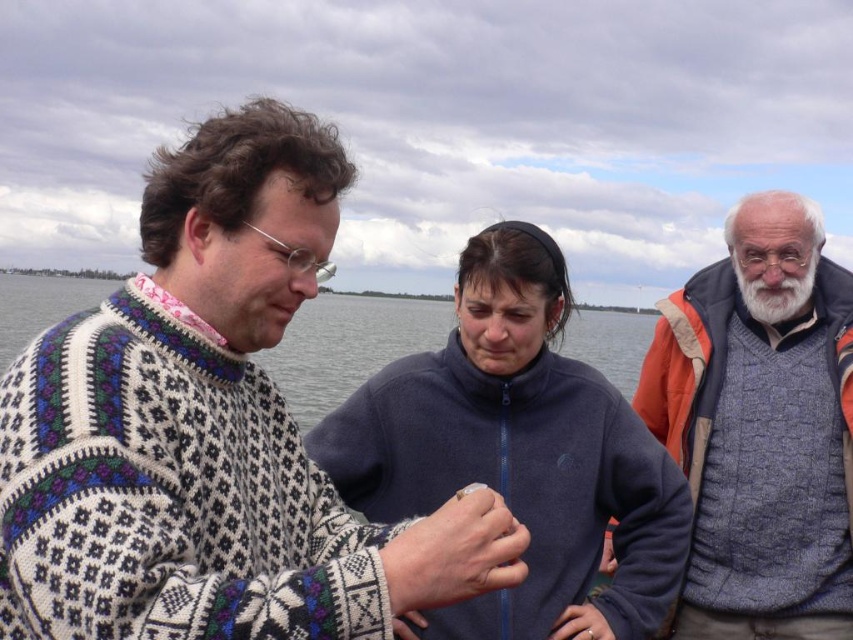
Question: Is dark blue fleece at center smaller than gray wool sweater at right?

Choices:
 (A) yes
 (B) no

Answer: (A)

Question: Estimate the real-world distances between objects in this image. Which object is closer to the gray wool sweater at right?

Choices:
 (A) dark blue fleece at center
 (B) knitted sweater at center
 (C) white fluffy beard at upper right

Answer: (C)

Question: Which object is positioned farthest from the knitted sweater at center?

Choices:
 (A) dark blue fleece at center
 (B) white fluffy beard at upper right

Answer: (B)

Question: Can you confirm if knitted sweater at center is positioned below dark blue fleece at center?

Choices:
 (A) no
 (B) yes

Answer: (A)

Question: Does knitted sweater at center appear on the right side of dark blue fleece at center?

Choices:
 (A) yes
 (B) no

Answer: (B)

Question: Which of the following is the farthest from the observer?

Choices:
 (A) (537, 580)
 (B) (178, 323)
 (C) (769, 300)
 (D) (770, 445)

Answer: (C)